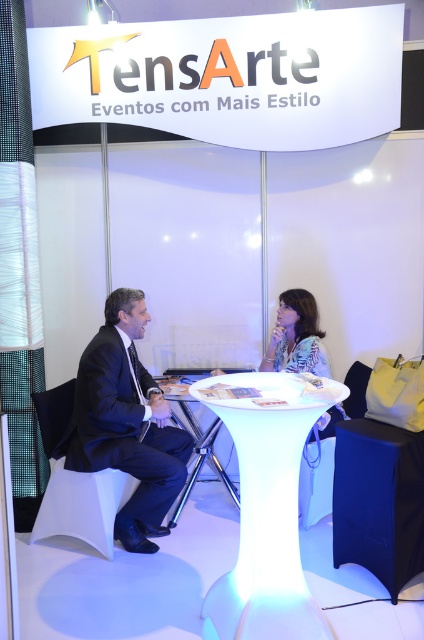
You are an event planner arranging a photo shoot at the trade show. You need to position a model wearing a printed fabric blouse at center so it aligns with the white plastic table at center. Based on the scene description, which side of the table should the model stand to ensure the blouse appears correctly positioned in the photo?

The printed fabric blouse at center is to the right of white plastic table at center, so the model should stand to the right side of the table to ensure proper alignment.

You are at a trade show and need to place a heavy equipment on the table. Which table should you choose between the white glossy table at center and the white plastic table at center based on their positions?

The white plastic table at center is above the white glossy table at center, so the white glossy table at center is more stable and better suited for placing heavy equipment.